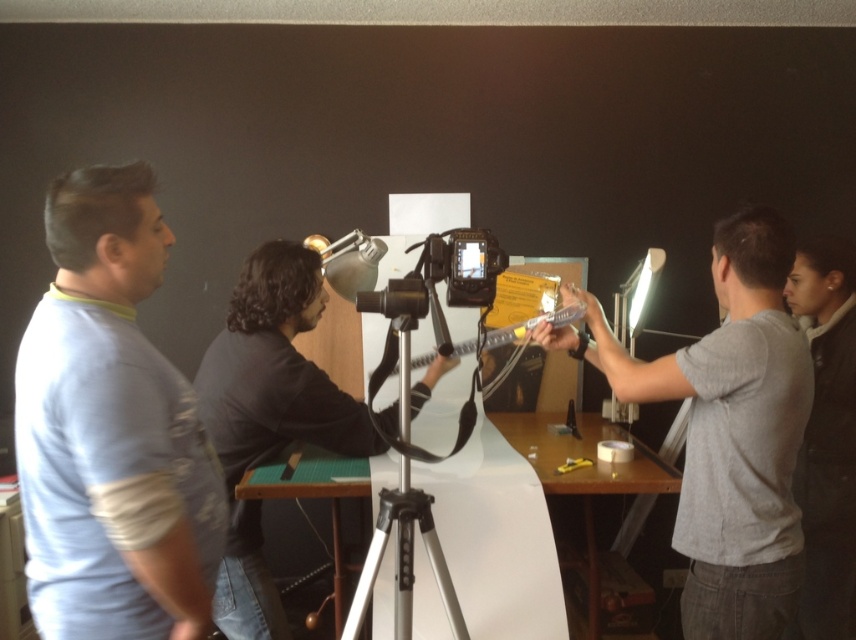
Does light blue cotton shirt at left have a lesser width compared to gray matte shirt at right?

Indeed, light blue cotton shirt at left has a lesser width compared to gray matte shirt at right.

Does light blue cotton shirt at left have a lesser height compared to gray matte shirt at right?

Yes.

At what (x,y) coordinates should I click in order to perform the action: click on light blue cotton shirt at left. Please return your answer as a coordinate pair (x, y). Looking at the image, I should click on (111, 429).

Which is behind, point (194, 384) or point (373, 541)?

Point (194, 384)

Is dark gray fabric shirt at center positioned at the back of silver metallic tripod at center?

Yes, it is.

The image size is (856, 640). I want to click on dark gray fabric shirt at center, so click(269, 416).

Is light blue cotton shirt at left further to camera compared to dark gray fabric shirt at center?

No, light blue cotton shirt at left is in front of dark gray fabric shirt at center.

Who is lower down, light blue cotton shirt at left or dark gray fabric shirt at center?

dark gray fabric shirt at center

This screenshot has width=856, height=640. In order to click on light blue cotton shirt at left in this screenshot , I will do `click(111, 429)`.